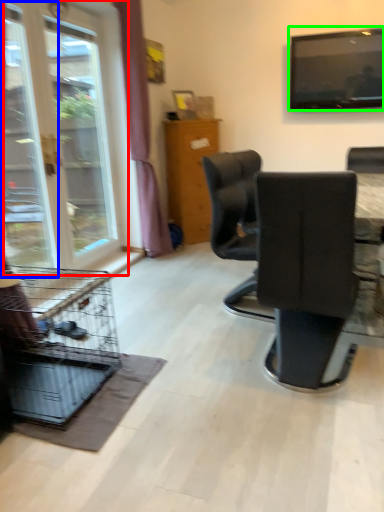
Question: Which object is positioned closest to window (highlighted by a red box)? Select from screen door (highlighted by a blue box) and television (highlighted by a green box).

Choices:
 (A) screen door
 (B) television

Answer: (A)